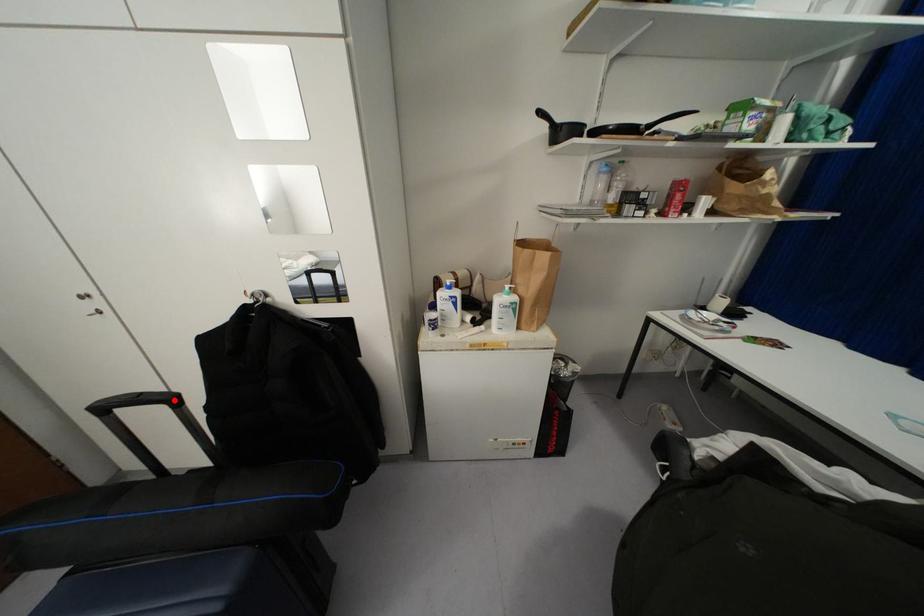
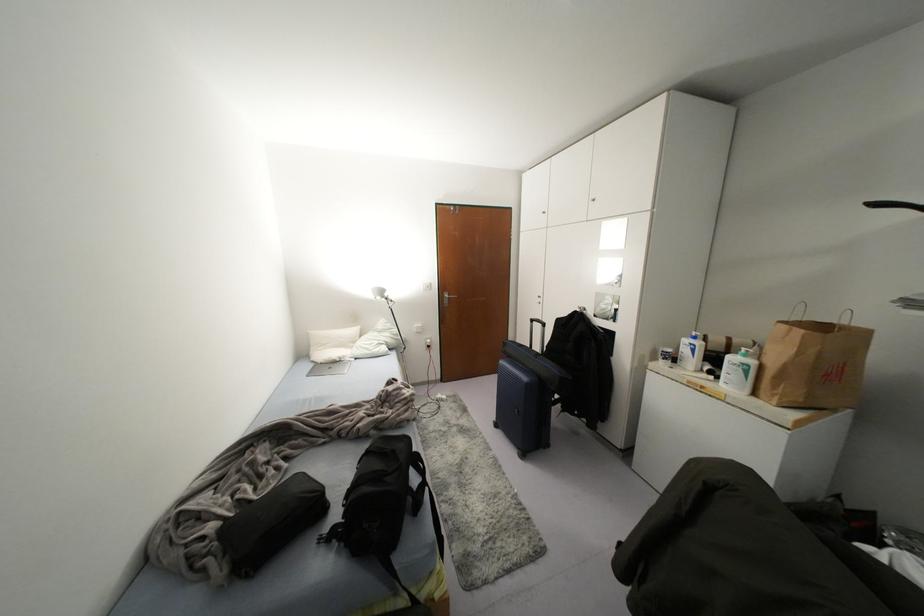
Find the pixel in the second image that matches the highlighted location in the first image.

(542, 323)